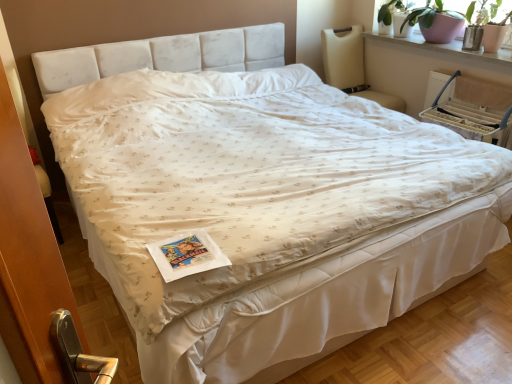
What are the coordinates of `free point above beige fabric armchair at upper right (from a real-world perspective)` in the screenshot? It's located at (462, 76).